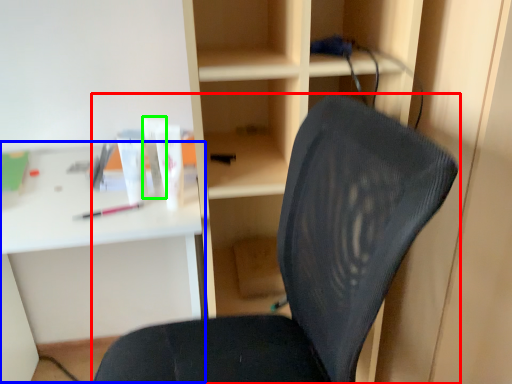
Question: Which object is positioned farthest from chair (highlighted by a red box)? Select from computer desk (highlighted by a blue box) and toiletry (highlighted by a green box).

Choices:
 (A) computer desk
 (B) toiletry

Answer: (A)